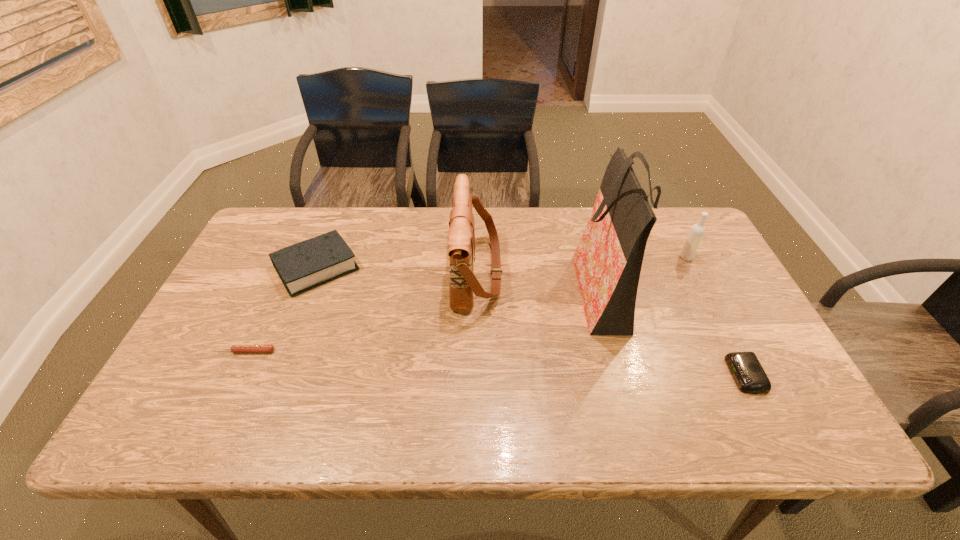
Where is `the tallest object`? This screenshot has height=540, width=960. the tallest object is located at coordinates (608, 260).

You are a GUI agent. You are given a task and a screenshot of the screen. Output one action in this format:
    pyautogui.click(x=<x>, y=<y>)
    Task: Click on the shopping bag
    
    Given the screenshot: What is the action you would take?
    click(x=608, y=260)

The height and width of the screenshot is (540, 960). Identify the location of shoulder bag. (461, 237).

In order to click on the third object from left to right in this screenshot , I will do `click(461, 237)`.

Identify the location of vodka. (697, 231).

I want to click on the third shortest object, so click(310, 263).

Find the location of a particular element. the second shortest object is located at coordinates (750, 377).

You are a GUI agent. You are given a task and a screenshot of the screen. Output one action in this format:
    pyautogui.click(x=<x>, y=<y>)
    Task: Click on the nearest object
    
    Given the screenshot: What is the action you would take?
    pyautogui.click(x=750, y=377)

Locate an element on the screen. The width and height of the screenshot is (960, 540). the shortest object is located at coordinates (234, 348).

Image resolution: width=960 pixels, height=540 pixels. I want to click on sausage, so click(234, 348).